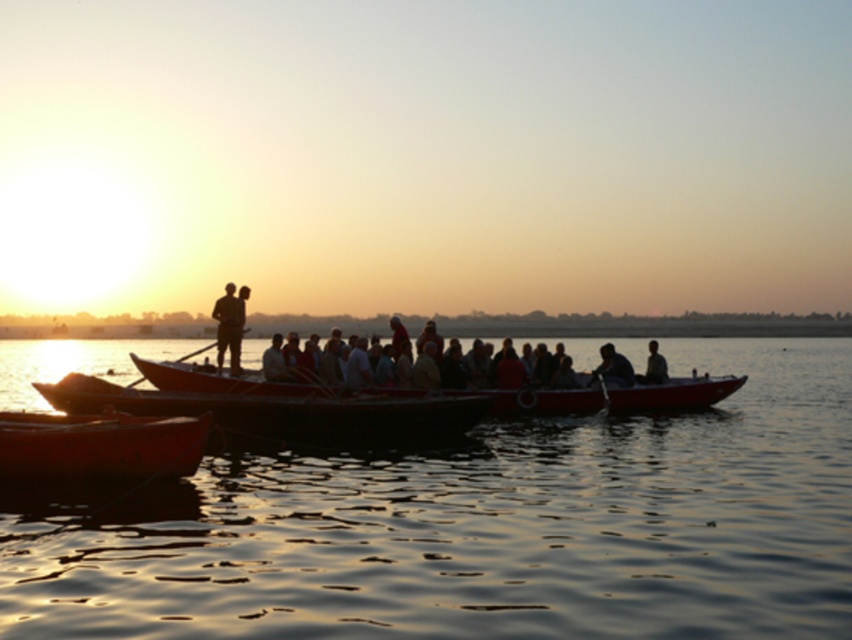
This screenshot has height=640, width=852. Identify the location of glistening water at center. (498, 529).

Which is more to the right, glistening water at center or wooden canoe at center?

From the viewer's perspective, glistening water at center appears more on the right side.

Is point (205, 488) positioned before point (306, 440)?

Yes, point (205, 488) is in front of point (306, 440).

Where is `glistening water at center`? The image size is (852, 640). glistening water at center is located at coordinates (498, 529).

Is point (353, 321) in front of point (603, 376)?

No, (353, 321) is behind (603, 376).

Which is in front, point (795, 333) or point (603, 349)?

Point (603, 349)

Where is `light brown wooden boat at center`? light brown wooden boat at center is located at coordinates (519, 326).

Is smooth wood canoe at lower left bigger than smooth dark skin at center?

Incorrect, smooth wood canoe at lower left is not larger than smooth dark skin at center.

Who is taller, smooth wood canoe at lower left or smooth dark skin at center?

smooth dark skin at center

Locate an element on the screen. smooth wood canoe at lower left is located at coordinates (96, 448).